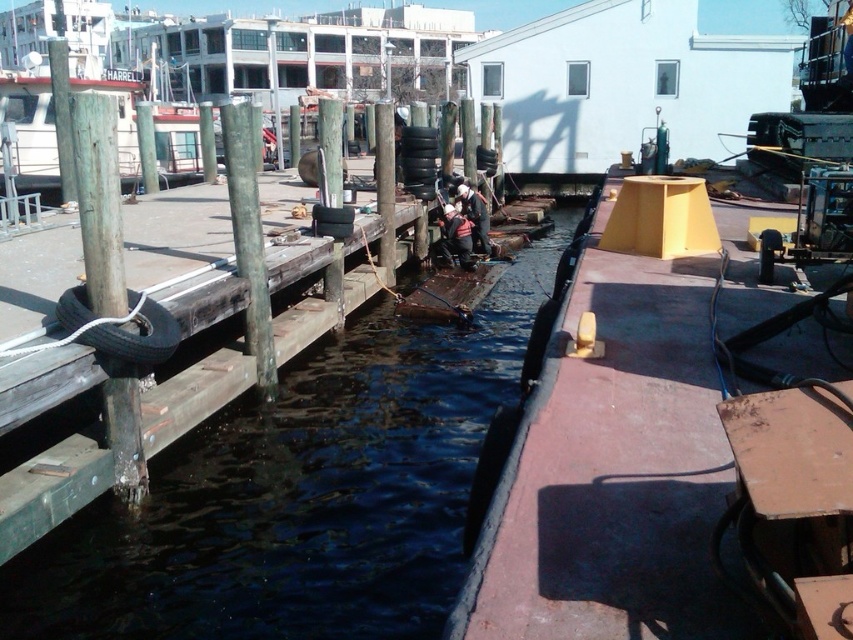
You are standing on the wooden pier and looking towards the larger vessel. Which of the two points, point [18,141] or point [462,200], is closer to you?

Point [18,141] is closer to you because it is further to the viewer than point [462,200].

You are a photographer standing on the pier and want to capture both the red knit cap at center and the white fabric jacket at center in the same frame. Which object should you focus on first to ensure both are in focus?

You should focus on the white fabric jacket at center first because the red knit cap at center is positioned under it, meaning the jacket is closer to you and the cap is further away. By focusing on the closer object, the depth of field may include both in focus.